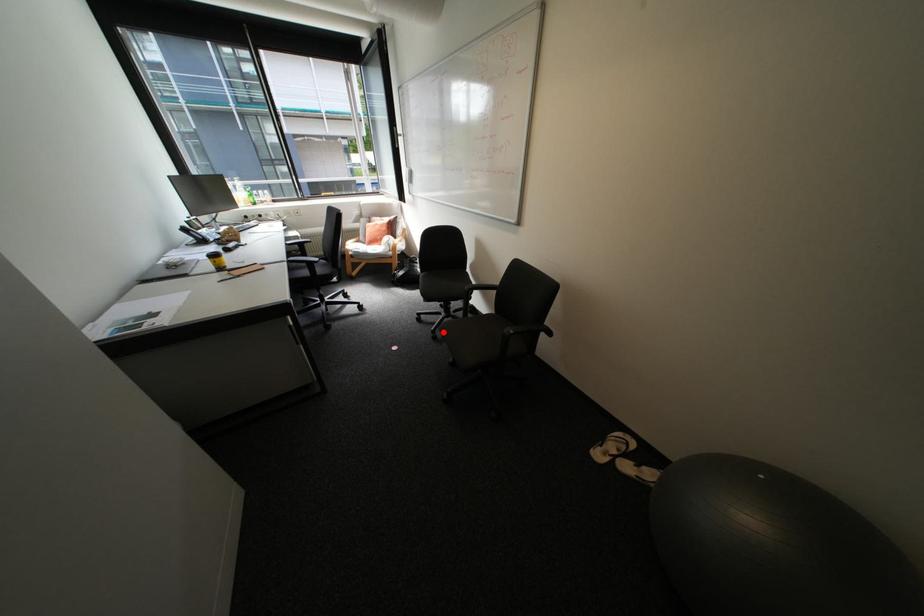
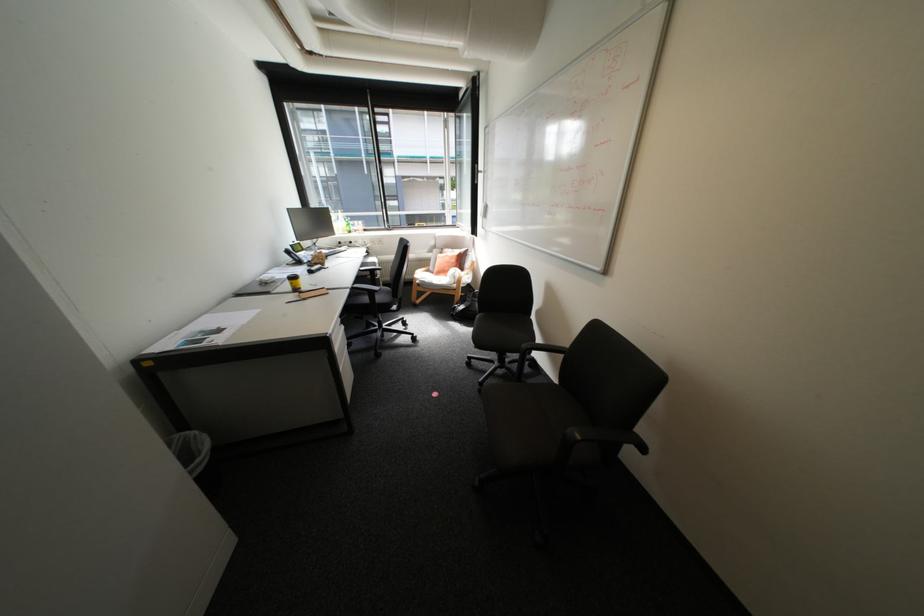
Locate, in the second image, the point that corresponds to the highlighted location in the first image.

(491, 384)